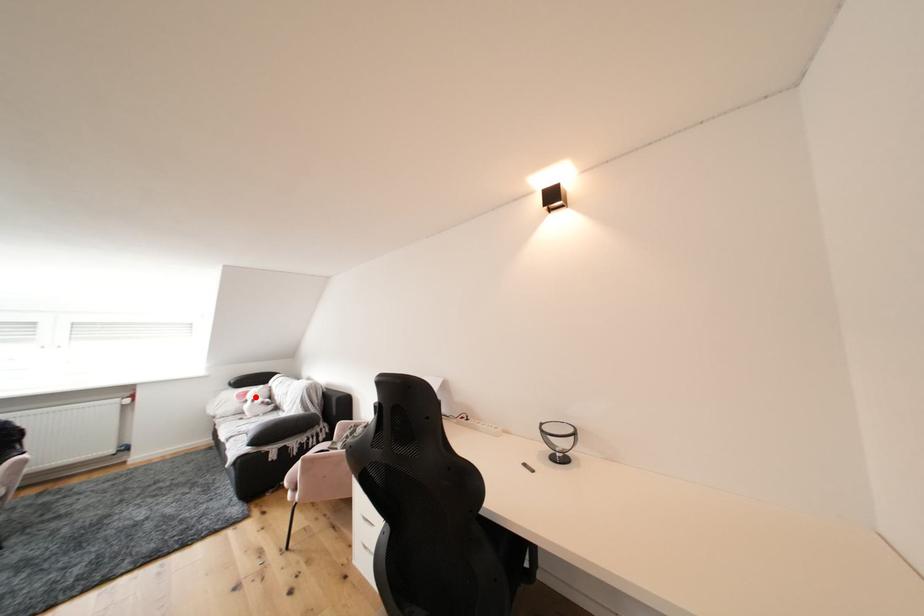
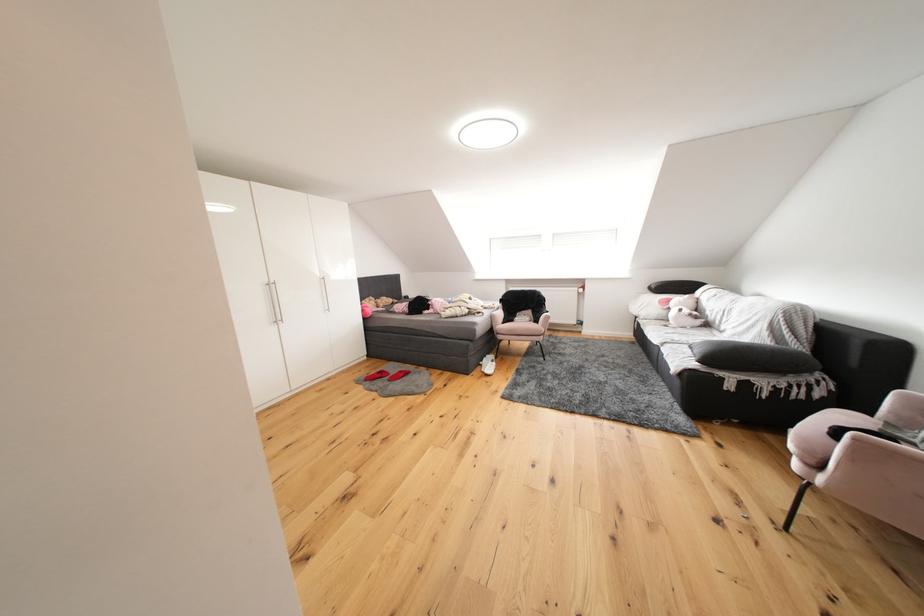
In the second image, find the point that corresponds to the highlighted location in the first image.

(677, 305)